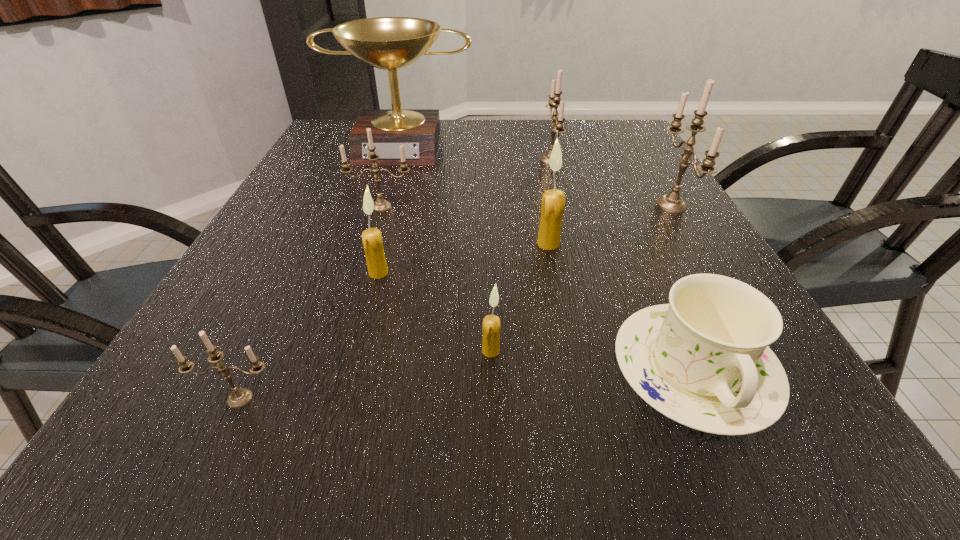
Identify the location of vacant space situated 0.230m on the back of the third biggest metallic candle. (397, 156).

Locate an element on the screen. This screenshot has width=960, height=540. vacant space situated 0.240m on the left of the nearest cream candle is located at coordinates (x=324, y=351).

Find the location of a particular element. Image resolution: width=960 pixels, height=540 pixels. free space located 0.340m on the back of the nearest candle is located at coordinates (313, 244).

Identify the location of award positioned at the far edge. The height and width of the screenshot is (540, 960). (390, 43).

At what (x,y) coordinates should I click in order to perform the action: click on candle present at the far edge. Please return your answer as a coordinate pair (x, y). Looking at the image, I should click on (555, 100).

Identify the location of candle present at the near edge. (239, 397).

Where is `chinaware situated at the near edge`? The image size is (960, 540). chinaware situated at the near edge is located at coordinates (703, 360).

The image size is (960, 540). Identify the location of award situated at the left edge. pyautogui.click(x=390, y=43).

I want to click on candle that is at the left edge, so click(x=239, y=397).

Find the location of `candle that is at the right edge`. candle that is at the right edge is located at coordinates (672, 202).